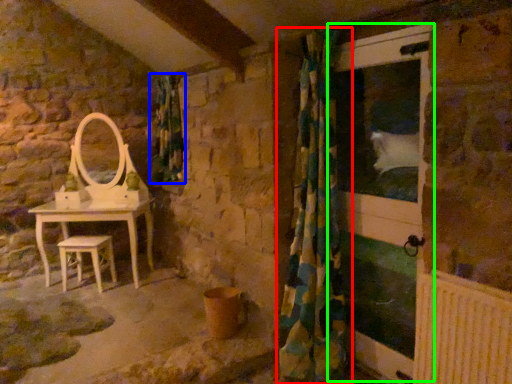
Question: Which object is positioned closest to curtain (highlighted by a red box)? Select from shower curtain (highlighted by a blue box) and screen door (highlighted by a green box).

Choices:
 (A) shower curtain
 (B) screen door

Answer: (B)